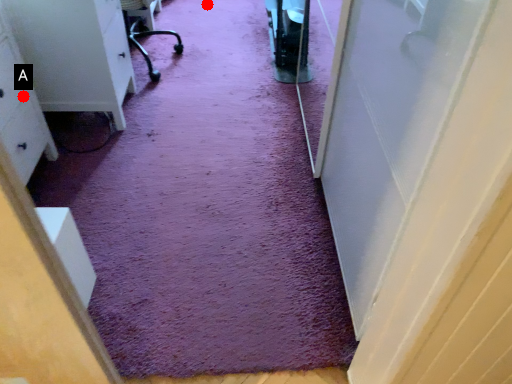
Question: Two points are circled on the image, labeled by A and B beside each circle. Which point is closer to the camera?

Choices:
 (A) A is closer
 (B) B is closer

Answer: (A)